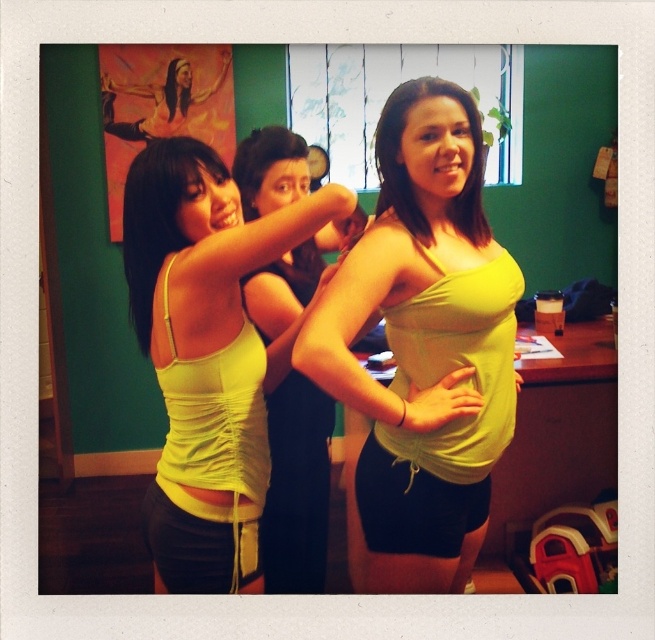
Question: Where is lime green fabric top at center located in relation to matte yellow fabric at center in the image?

Choices:
 (A) right
 (B) left

Answer: (B)

Question: Which point is farther from the camera taking this photo?

Choices:
 (A) (145, 534)
 (B) (196, 337)

Answer: (A)

Question: Which object is the farthest from the matte yellow tank top at center?

Choices:
 (A) lime green fabric top at center
 (B) yellow fabric at lower center
 (C) matte yellow fabric at center

Answer: (C)

Question: Does lime green fabric top at center come in front of matte yellow fabric at center?

Choices:
 (A) no
 (B) yes

Answer: (B)

Question: Which point is closer to the camera taking this photo?

Choices:
 (A) (460, 538)
 (B) (383, 406)
 (C) (193, 468)

Answer: (B)

Question: Can you confirm if matte yellow tank top at center is smaller than matte yellow fabric at center?

Choices:
 (A) no
 (B) yes

Answer: (A)